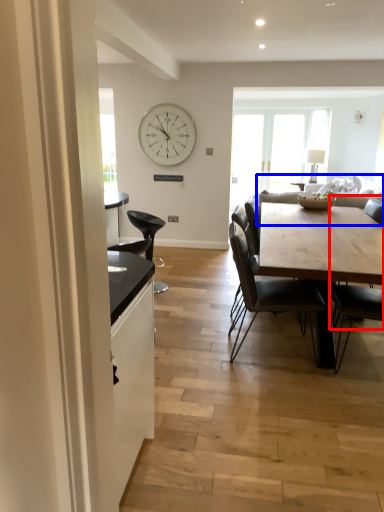
Question: Which of the following is the closest to the observer, chair (highlighted by a red box) or couch (highlighted by a blue box)?

Choices:
 (A) chair
 (B) couch

Answer: (A)